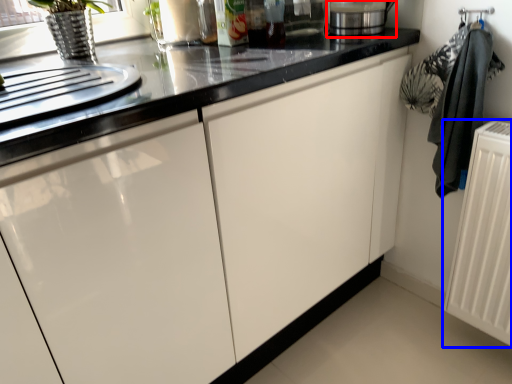
Question: Which object appears closest to the camera in this image, appliance (highlighted by a red box) or radiator (highlighted by a blue box)?

Choices:
 (A) appliance
 (B) radiator

Answer: (B)